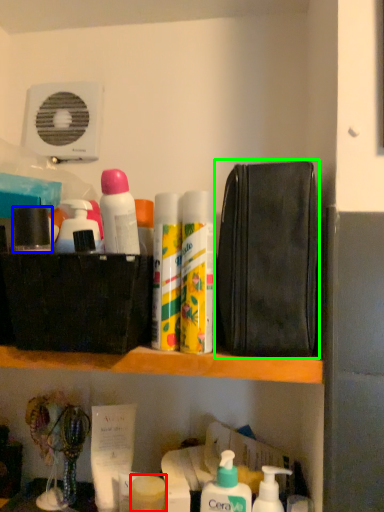
Question: Which is farther away from toiletry (highlighted by a red box)? toiletry (highlighted by a blue box) or pouch (highlighted by a green box)?

Choices:
 (A) toiletry
 (B) pouch

Answer: (A)